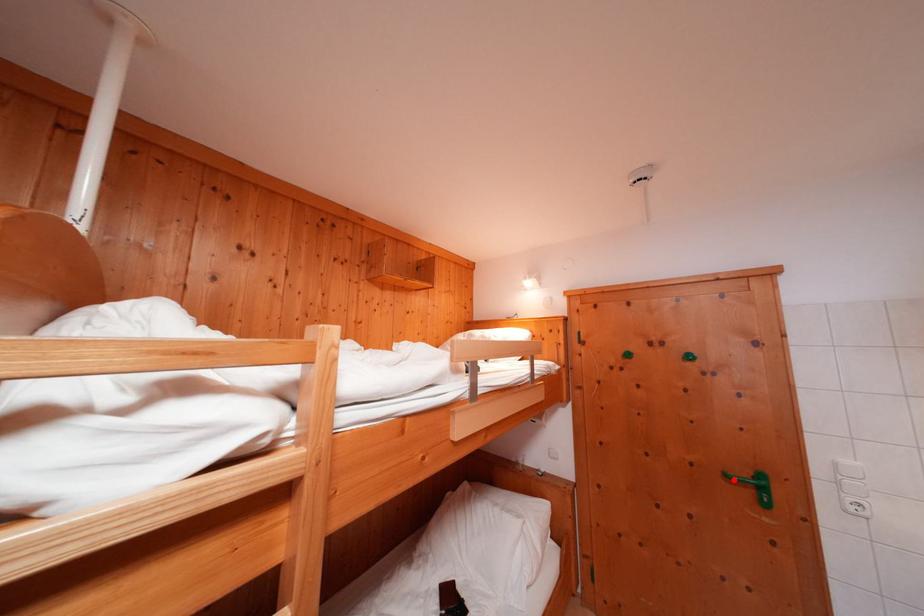
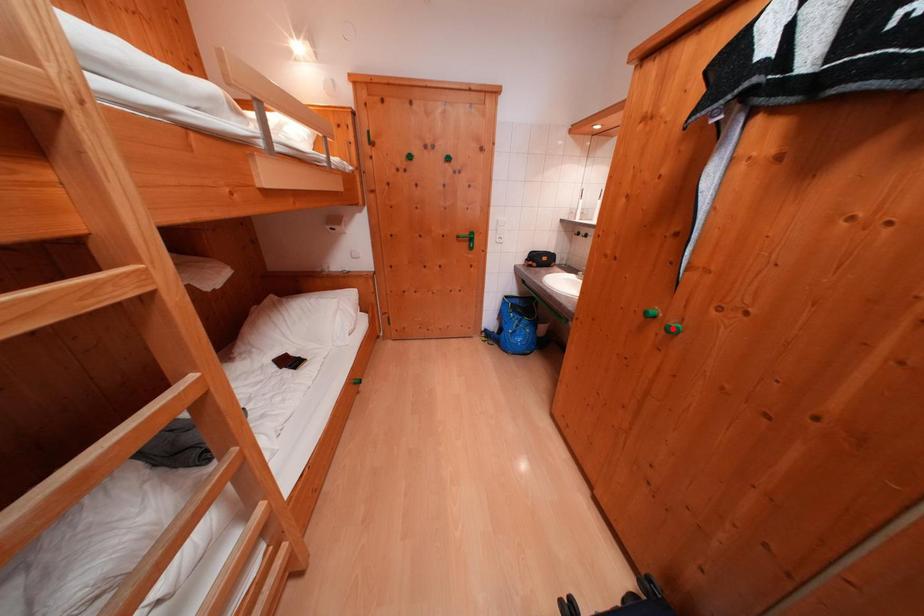
I am providing you with two images of the same scene from different viewpoints. A red point is marked on the first image and another point is marked on the second image. Do the highlighted points in image1 and image2 indicate the same real-world spot?

No